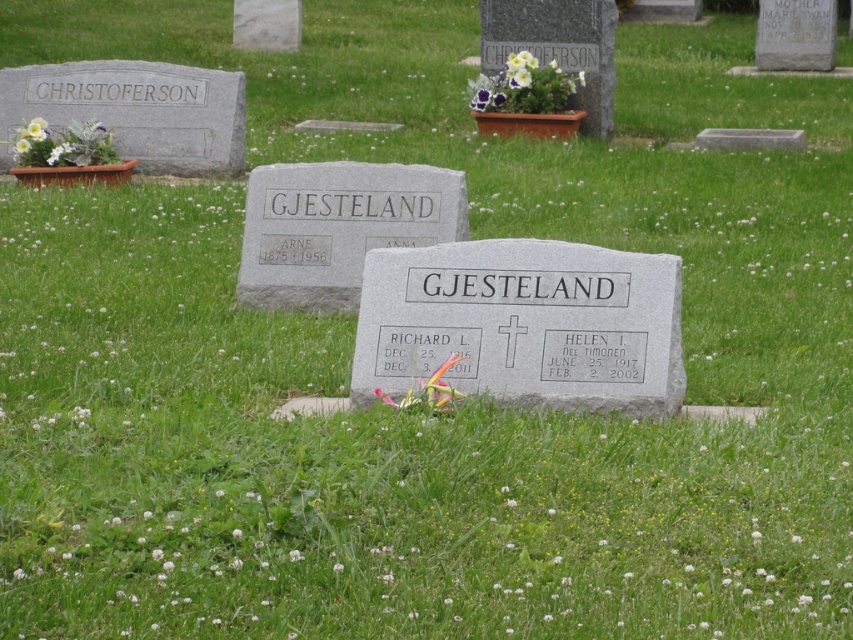
You are standing in a cemetery and see the gray granite gravestone at center and the purple fabric flower at upper center. Which object is closer to you?

The gray granite gravestone at center is closer to the viewer than the purple fabric flower at upper center.

You are a visitor at the cemetery and want to place a new flower next to the gray polished stone gravestone at center. Considering their sizes, will the purple fabric flower at upper center fit beside it without overlapping?

The gray polished stone gravestone at center is wider than the purple fabric flower at upper center, so there should be enough space to place the new flower next to the gray polished stone gravestone at center without overlapping.